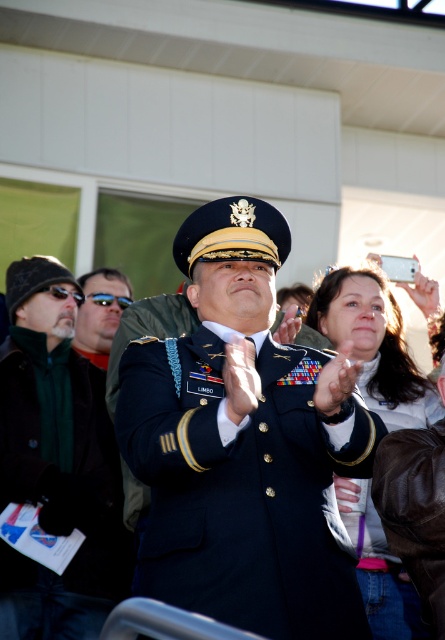
Question: Among these objects, which one is farthest from the camera?

Choices:
 (A) navy blue uniform at center
 (B) green matte sunglasses at left
 (C) matte gray jacket at upper right
 (D) dark green wool jacket at left

Answer: (B)

Question: Does navy blue uniform at center have a lesser width compared to green matte sunglasses at left?

Choices:
 (A) no
 (B) yes

Answer: (A)

Question: Does dark green wool jacket at left have a smaller size compared to matte gray jacket at upper right?

Choices:
 (A) no
 (B) yes

Answer: (B)

Question: Which is farther from the green matte sunglasses at left?

Choices:
 (A) matte gray jacket at upper right
 (B) dark green wool jacket at left
 (C) navy blue uniform at center

Answer: (C)

Question: Which is farther from the dark green wool jacket at left?

Choices:
 (A) green matte sunglasses at left
 (B) navy blue uniform at center

Answer: (A)

Question: Can you confirm if matte gray jacket at upper right is positioned above green matte sunglasses at left?

Choices:
 (A) no
 (B) yes

Answer: (A)